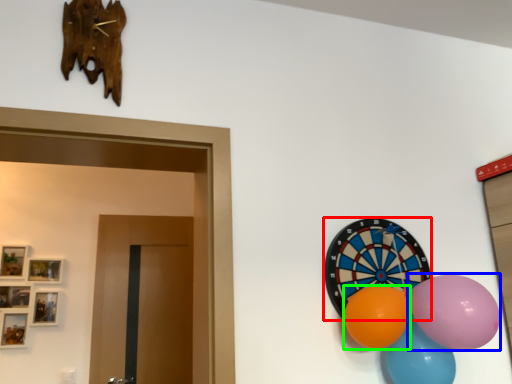
Question: Which object is positioned farthest from oval (highlighted by a red box)? Select from balloon (highlighted by a blue box) and balloon (highlighted by a green box).

Choices:
 (A) balloon
 (B) balloon

Answer: (A)